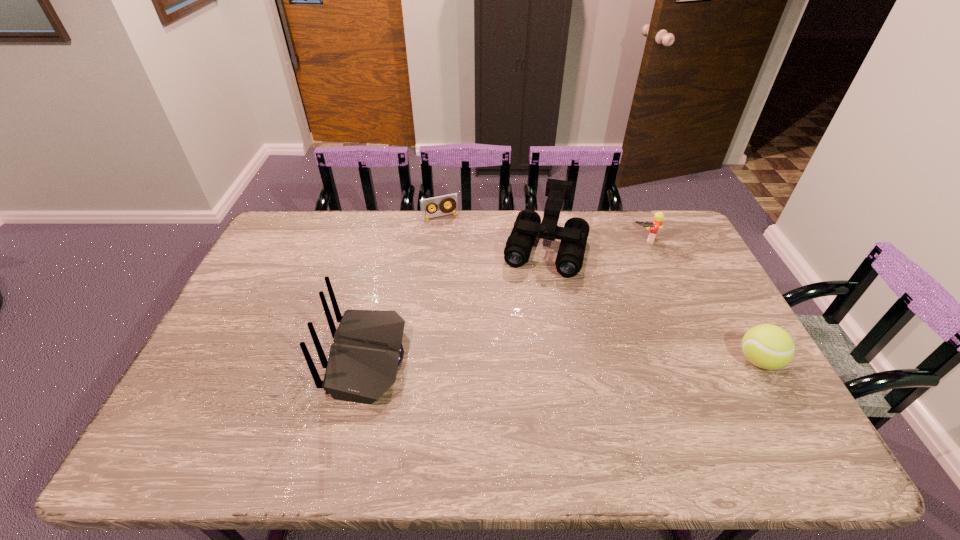
The height and width of the screenshot is (540, 960). What are the coordinates of `free space at the near left corner of the desktop` in the screenshot? It's located at (236, 410).

The height and width of the screenshot is (540, 960). In the image, there is a desktop. Identify the location of vacant area at the far right corner. (682, 237).

You are a GUI agent. You are given a task and a screenshot of the screen. Output one action in this format:
    pyautogui.click(x=<x>, y=<y>)
    Task: Click on the vacant area at the near right corner
    
    Given the screenshot: What is the action you would take?
    pyautogui.click(x=765, y=406)

The image size is (960, 540). Find the location of `empty space that is in between the router and the binoculars`. empty space that is in between the router and the binoculars is located at coordinates (457, 303).

You are a GUI agent. You are given a task and a screenshot of the screen. Output one action in this format:
    pyautogui.click(x=<x>, y=<y>)
    Task: Click on the vacant area between the third object from right to left and the shortest object
    The width and height of the screenshot is (960, 540).
    Given the screenshot: What is the action you would take?
    pyautogui.click(x=493, y=233)

Locate an element on the screen. free area in between the router and the videotape is located at coordinates (404, 288).

At what (x,y) coordinates should I click in order to perform the action: click on unoccupied area between the router and the binoculars. Please return your answer as a coordinate pair (x, y). Looking at the image, I should click on (457, 303).

Identify the location of free spot between the router and the binoculars. (457, 303).

Locate an element on the screen. Image resolution: width=960 pixels, height=540 pixels. vacant space that's between the router and the Lego is located at coordinates (506, 299).

Find the location of `empty space that is in between the tennis ball and the router`. empty space that is in between the tennis ball and the router is located at coordinates (563, 359).